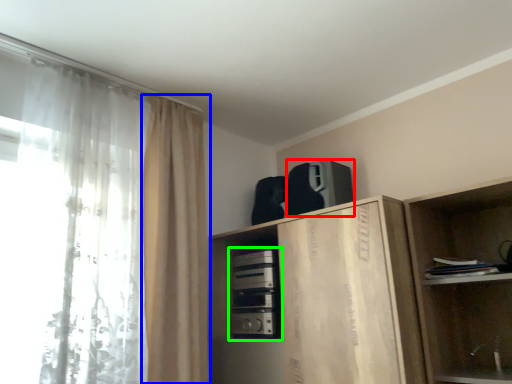
Question: Based on their relative distances, which object is farther from appliance (highlighted by a red box)? Choose from curtain (highlighted by a blue box) and appliance (highlighted by a green box).

Choices:
 (A) curtain
 (B) appliance

Answer: (A)